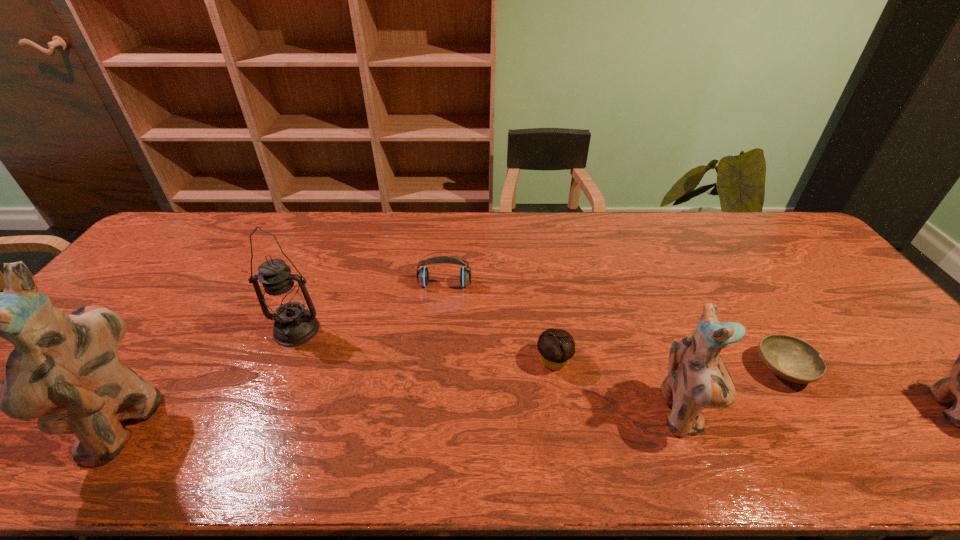
Where is `the sixth tallest object`? the sixth tallest object is located at coordinates (556, 347).

Where is `vacant space located 0.090m on the front-facing side of the leftmost object`? The width and height of the screenshot is (960, 540). vacant space located 0.090m on the front-facing side of the leftmost object is located at coordinates (54, 423).

At what (x,y) coordinates should I click in order to perform the action: click on vacant space located on the front-facing side of the leftmost object. Please return your answer as a coordinate pair (x, y). Looking at the image, I should click on (62, 423).

Where is `free space located on the front-facing side of the third object from right to left`? The height and width of the screenshot is (540, 960). free space located on the front-facing side of the third object from right to left is located at coordinates (724, 415).

Find the location of a particular element. The image size is (960, 540). vacant position located on the ear cups of the headset is located at coordinates (441, 328).

Find the location of a particular element. Image resolution: width=960 pixels, height=540 pixels. free space located on the left of the sixth object from left to right is located at coordinates (637, 369).

Identify the location of vacant position located 0.370m on the left of the second object from left to right. This screenshot has width=960, height=540. (134, 330).

You are a GUI agent. You are given a task and a screenshot of the screen. Output one action in this format:
    pyautogui.click(x=<x>, y=<y>)
    Task: Click on the vacant region located on the back of the fourth object from left to right
    This screenshot has height=540, width=960.
    Given the screenshot: What is the action you would take?
    pyautogui.click(x=547, y=324)

Find the location of a particular element. bowl at the near edge is located at coordinates (790, 358).

In order to click on vacant position at the far edge of the desktop in this screenshot , I will do 516,225.